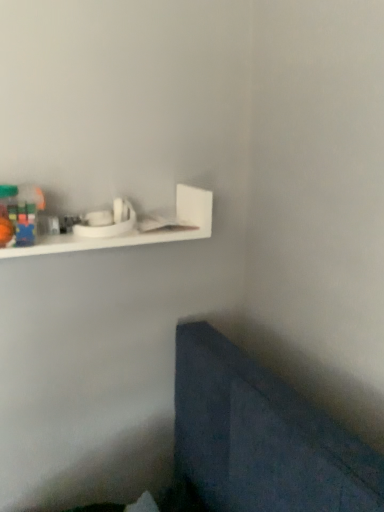
Question: From the image's perspective, is rubberized plastic blocks at upper left under white matte shelf at upper left?

Choices:
 (A) yes
 (B) no

Answer: (A)

Question: Would you consider rubberized plastic blocks at upper left to be distant from white matte shelf at upper left?

Choices:
 (A) no
 (B) yes

Answer: (A)

Question: Is rubberized plastic blocks at upper left not within white matte shelf at upper left?

Choices:
 (A) yes
 (B) no

Answer: (B)

Question: From a real-world perspective, is rubberized plastic blocks at upper left located higher than white matte shelf at upper left?

Choices:
 (A) no
 (B) yes

Answer: (B)

Question: Are rubberized plastic blocks at upper left and white matte shelf at upper left beside each other?

Choices:
 (A) yes
 (B) no

Answer: (B)

Question: Is rubberized plastic blocks at upper left further to the viewer compared to white matte shelf at upper left?

Choices:
 (A) no
 (B) yes

Answer: (A)

Question: From a real-world perspective, is white matte shelf at upper left located beneath rubberized plastic blocks at upper left?

Choices:
 (A) yes
 (B) no

Answer: (A)

Question: Is white matte shelf at upper left not inside rubberized plastic blocks at upper left?

Choices:
 (A) no
 (B) yes

Answer: (B)

Question: From the image's perspective, is white matte shelf at upper left above rubberized plastic blocks at upper left?

Choices:
 (A) no
 (B) yes

Answer: (B)

Question: Can you confirm if white matte shelf at upper left is taller than rubberized plastic blocks at upper left?

Choices:
 (A) yes
 (B) no

Answer: (A)

Question: Can you confirm if white matte shelf at upper left is wider than rubberized plastic blocks at upper left?

Choices:
 (A) yes
 (B) no

Answer: (A)

Question: Is white matte shelf at upper left shorter than rubberized plastic blocks at upper left?

Choices:
 (A) yes
 (B) no

Answer: (B)

Question: In terms of height, does rubberized plastic blocks at upper left look taller or shorter compared to white matte shelf at upper left?

Choices:
 (A) short
 (B) tall

Answer: (A)